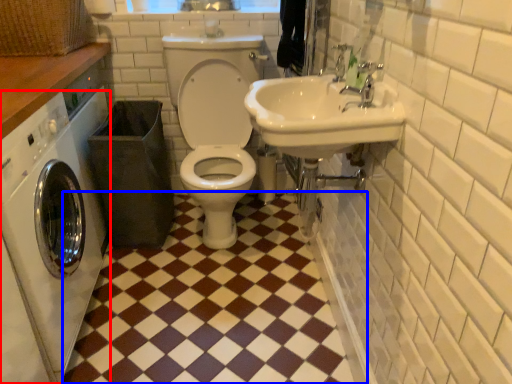
Question: Which object is further to the camera taking this photo, washing machine (highlighted by a red box) or ceramic tile (highlighted by a blue box)?

Choices:
 (A) washing machine
 (B) ceramic tile

Answer: (B)